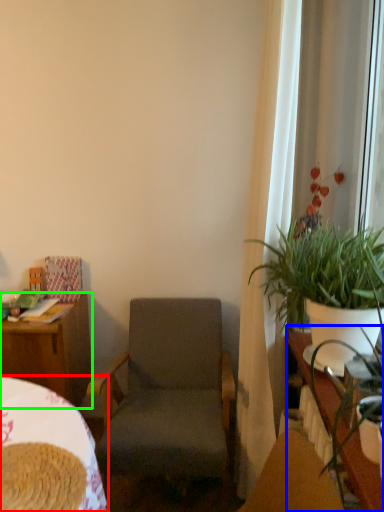
Question: Which object is positioned closest to bed (highlighted by a red box)? Select from table (highlighted by a blue box) and desk (highlighted by a green box).

Choices:
 (A) table
 (B) desk

Answer: (B)